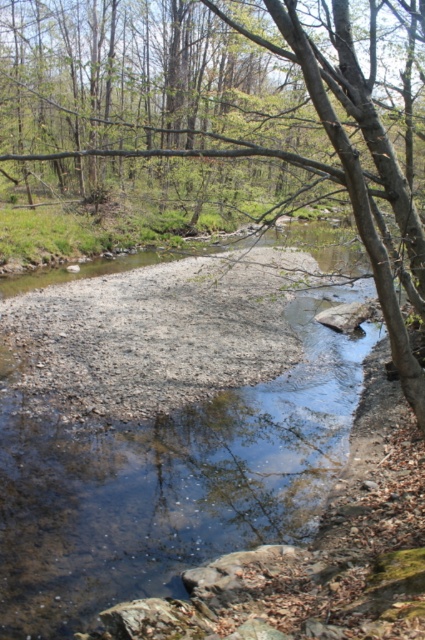
You are standing at the edge of the stream and see two points in the image. The first point is at coordinates point (17, 1) and the second is at point (98, 461). Which point is closer to you?

Point (98, 461) is closer to you because it is less further to the camera than point (17, 1).

You are a hiker standing at the edge of the stream. You need to cross to the other side. The brown bark tree at center and the clear water at center are in your path. Which object should you avoid stepping on to ensure stability?

You should avoid stepping on the clear water at center because the brown bark tree at center is bigger and provides a more stable surface for crossing.